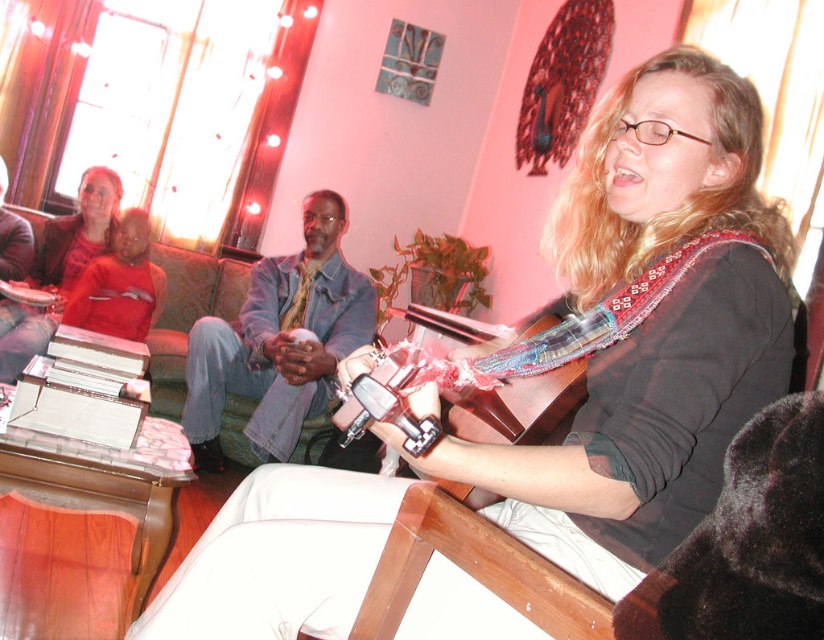
Does denim jacket at center appear under matte red shirt at upper left?

Correct, denim jacket at center is located below matte red shirt at upper left.

Between denim jacket at center and matte red shirt at upper left, which one has more height?

denim jacket at center is taller.

Where is `denim jacket at center`? The image size is (824, 640). denim jacket at center is located at coordinates (279, 340).

At what (x,y) coordinates should I click in order to perform the action: click on denim jacket at center. Please return your answer as a coordinate pair (x, y). This screenshot has width=824, height=640. Looking at the image, I should click on (279, 340).

Which is more to the left, denim jacket at center or metallic silver guitar at center?

Positioned to the left is denim jacket at center.

Is point (288, 396) closer to camera compared to point (489, 401)?

That is False.

The image size is (824, 640). Identify the location of denim jacket at center. (279, 340).

Is point (146, 257) positioned after point (330, 464)?

Yes, it is.

Which is in front, point (103, 300) or point (356, 465)?

Positioned in front is point (356, 465).

Locate an element on the screen. matte red shirt at upper left is located at coordinates (119, 285).